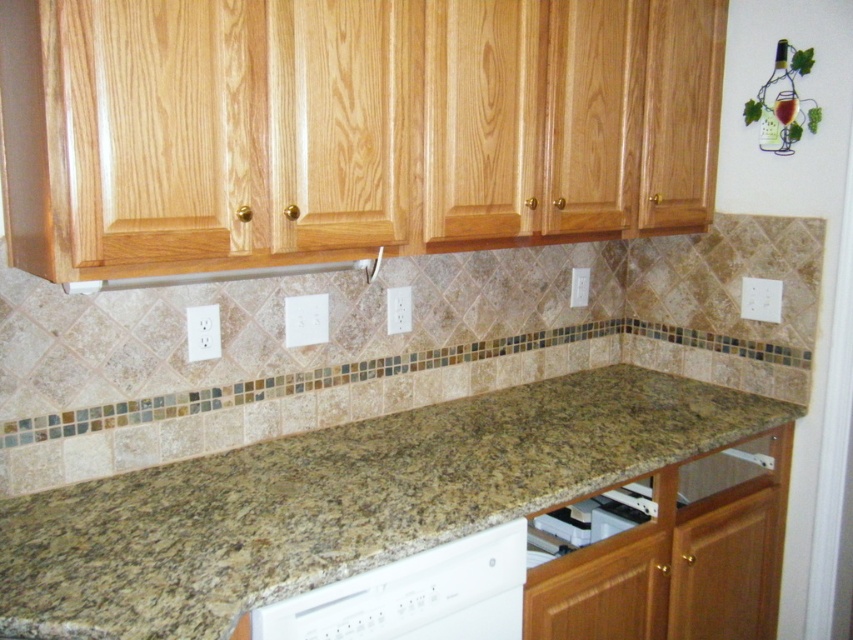
Is granite at center positioned before white matte dishwasher at lower center?

Yes, granite at center is in front of white matte dishwasher at lower center.

The height and width of the screenshot is (640, 853). I want to click on granite at center, so click(x=578, y=426).

Between point (569, 400) and point (325, 628), which one is positioned behind?

Point (569, 400)

Where is `granite at center`? This screenshot has width=853, height=640. granite at center is located at coordinates (578, 426).

Is granite at center wider than white plastic dishwasher at lower center?

Indeed, granite at center has a greater width compared to white plastic dishwasher at lower center.

Is point (607, 401) more distant than point (641, 497)?

Yes, it is.

The image size is (853, 640). I want to click on granite at center, so click(578, 426).

Image resolution: width=853 pixels, height=640 pixels. What are the coordinates of `granite at center` in the screenshot? It's located at (578, 426).

Can you confirm if white matte dishwasher at lower center is thinner than white plastic dishwasher at lower center?

In fact, white matte dishwasher at lower center might be wider than white plastic dishwasher at lower center.

Can you confirm if white matte dishwasher at lower center is taller than white plastic dishwasher at lower center?

Yes.

Who is more distant from viewer, (305, 611) or (595, 496)?

Point (595, 496)

Locate an element on the screen. white matte dishwasher at lower center is located at coordinates (415, 595).